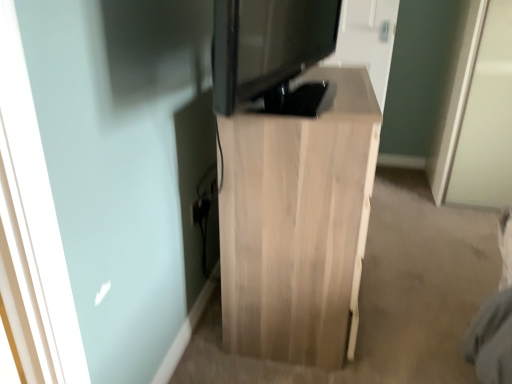
Question: Is matte black monitor at center with light wood cabinet at center?

Choices:
 (A) no
 (B) yes

Answer: (A)

Question: Is matte black monitor at center in front of light wood cabinet at center?

Choices:
 (A) yes
 (B) no

Answer: (A)

Question: Does matte black monitor at center have a greater width compared to light wood cabinet at center?

Choices:
 (A) no
 (B) yes

Answer: (A)

Question: Is matte black monitor at center shorter than light wood cabinet at center?

Choices:
 (A) no
 (B) yes

Answer: (B)

Question: From a real-world perspective, is matte black monitor at center physically above light wood cabinet at center?

Choices:
 (A) yes
 (B) no

Answer: (A)

Question: Is matte black monitor at center positioned beyond the bounds of light wood cabinet at center?

Choices:
 (A) yes
 (B) no

Answer: (A)

Question: Is light wood cabinet at center smaller than matte black monitor at center?

Choices:
 (A) no
 (B) yes

Answer: (A)

Question: Is light wood cabinet at center positioned beyond the bounds of matte black monitor at center?

Choices:
 (A) yes
 (B) no

Answer: (A)

Question: Can matte black monitor at center be found inside light wood cabinet at center?

Choices:
 (A) no
 (B) yes

Answer: (A)

Question: Does light wood cabinet at center have a lesser height compared to matte black monitor at center?

Choices:
 (A) no
 (B) yes

Answer: (A)

Question: From the image's perspective, is light wood cabinet at center over matte black monitor at center?

Choices:
 (A) yes
 (B) no

Answer: (B)

Question: Is light wood cabinet at center further to camera compared to matte black monitor at center?

Choices:
 (A) yes
 (B) no

Answer: (A)

Question: In terms of size, does matte black monitor at center appear bigger or smaller than light wood cabinet at center?

Choices:
 (A) big
 (B) small

Answer: (B)